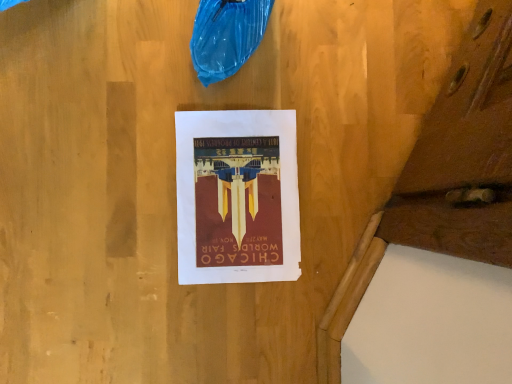
Where is `matte paper poster at center`? This screenshot has width=512, height=384. matte paper poster at center is located at coordinates (237, 196).

Measure the distance between matte paper poster at center and camera.

They are 28.31 inches apart.

What do you see at coordinates (237, 196) in the screenshot?
I see `matte paper poster at center` at bounding box center [237, 196].

At what (x,y) coordinates should I click in order to perform the action: click on matte paper poster at center. Please return your answer as a coordinate pair (x, y). Image resolution: width=512 pixels, height=384 pixels. Looking at the image, I should click on (237, 196).